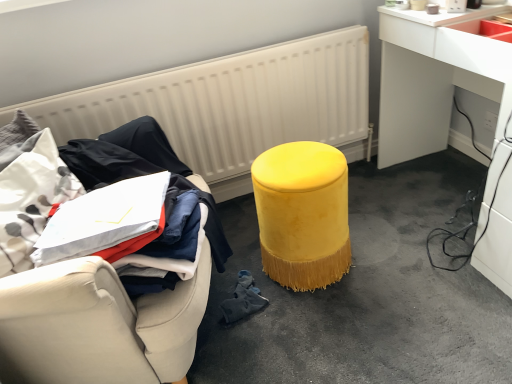
Find the location of a particular element. vacant space to the right of velvet yellow stool at center is located at coordinates (384, 249).